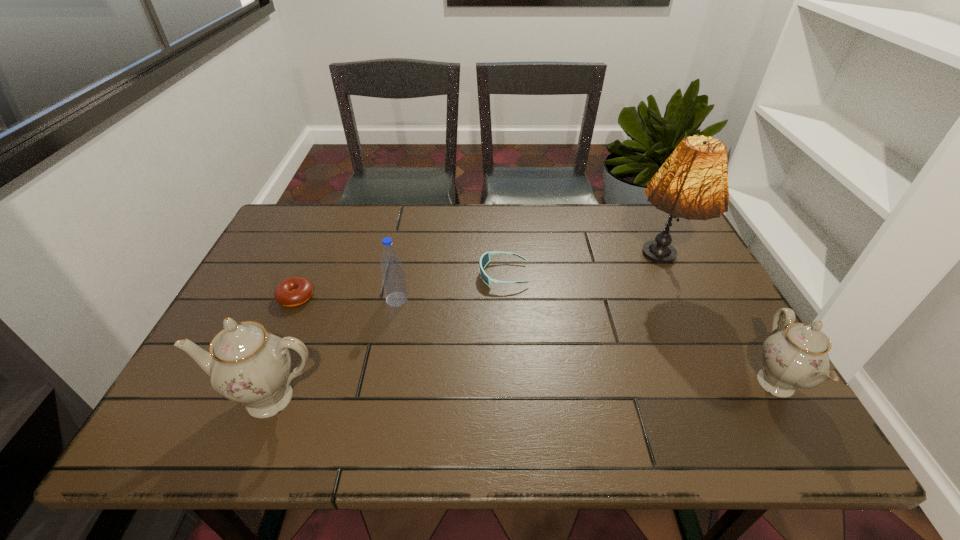
You are a GUI agent. You are given a task and a screenshot of the screen. Output one action in this format:
    pyautogui.click(x=<x>, y=<y>)
    Task: Click on the vacant area that lies between the shorter chinaware and the tallest object
    
    Given the screenshot: What is the action you would take?
    pyautogui.click(x=717, y=326)

Find the location of a particular element. The image size is (960, 540). blank region between the fourth object from left to right and the lampshade is located at coordinates (581, 272).

Where is `free space between the shorter chinaware and the lampshade`? This screenshot has height=540, width=960. free space between the shorter chinaware and the lampshade is located at coordinates (717, 326).

The image size is (960, 540). In order to click on vacant region between the fifth shortest object and the water bottle in this screenshot , I will do `click(333, 349)`.

Locate an element on the screen. The image size is (960, 540). vacant space that is in between the third object from right to left and the fourth object from right to left is located at coordinates (450, 287).

Where is `the second closest object relative to the shorter chinaware`? The width and height of the screenshot is (960, 540). the second closest object relative to the shorter chinaware is located at coordinates (485, 258).

Find the location of `object that stands as the closest to the second tallest object`. object that stands as the closest to the second tallest object is located at coordinates (294, 291).

This screenshot has width=960, height=540. Find the location of `free space that satisfies the following two spatial constraints: 1. on the front-facing side of the tallest object; 2. on the front-facing side of the fourth object from left to right`. free space that satisfies the following two spatial constraints: 1. on the front-facing side of the tallest object; 2. on the front-facing side of the fourth object from left to right is located at coordinates (660, 274).

The width and height of the screenshot is (960, 540). Find the location of `blank area in the image that satisfies the following two spatial constraints: 1. on the front-facing side of the third object from right to left; 2. on the front side of the water bottle`. blank area in the image that satisfies the following two spatial constraints: 1. on the front-facing side of the third object from right to left; 2. on the front side of the water bottle is located at coordinates (505, 300).

Where is `vacant area in the image that satisfies the following two spatial constraints: 1. on the front side of the doughnut; 2. on the left side of the third object from left to right`? Image resolution: width=960 pixels, height=540 pixels. vacant area in the image that satisfies the following two spatial constraints: 1. on the front side of the doughnut; 2. on the left side of the third object from left to right is located at coordinates (296, 300).